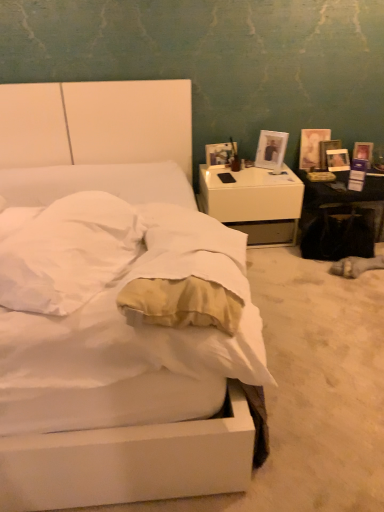
Question: From a real-world perspective, relative to white glossy table at right, is matte white picture frame at right, which is the first picture frame in back-to-front order, vertically above or below?

Choices:
 (A) below
 (B) above

Answer: (B)

Question: Is point (332, 154) closer or farther from the camera than point (299, 170)?

Choices:
 (A) closer
 (B) farther

Answer: (A)

Question: Based on their relative distances, which object is nearer to the soft beige pillow at center?

Choices:
 (A) white glossy nightstand at upper right
 (B) white glossy picture frame at upper right, which is counted as the first picture frame, starting from the front
 (C) white glossy table at right
 (D) white matte bed at center
 (E) white soft mattress at center

Answer: (E)

Question: Which object is positioned closest to the soft beige pillow at center?

Choices:
 (A) white glossy table at right
 (B) white matte bed at center
 (C) white glossy nightstand at upper right
 (D) white soft mattress at center
 (E) white glossy picture frame at upper right, which is counted as the first picture frame, starting from the front

Answer: (D)